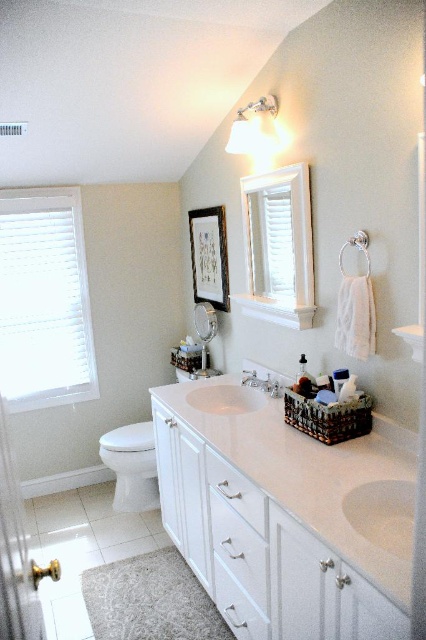
You are a plumber who needs to install a new faucet. The current satin nickel faucet at center is too old. You have a new faucet that requires a minimum of 40 centimeters of space between it and the edge of the white glossy countertop at center to avoid blocking the sink drain. Can you replace the old faucet with the new one without any issues?

The white glossy countertop at center and satin nickel faucet at center are 43.59 centimeters apart. Since the required minimum space is 40 centimeters, the new faucet can be installed without blocking the sink drain.

You are a home inspector assessing bathroom fixtures. You need to determine which of the two objects, the white glossy toilet bowl at lower left or the white glossy sink at center, has a greater height. Based on the scene, which one is taller?

The white glossy toilet bowl at lower left is taller than the white glossy sink at center according to the description.

Consider the image. You are standing at the entrance of the bathroom and want to reach the white glossy toilet bowl at lower left. According to the bathroom layout, where should you head to find it?

The white glossy toilet bowl at lower left is located at point (132, 467), so you should head to the lower left area of the bathroom to find it.